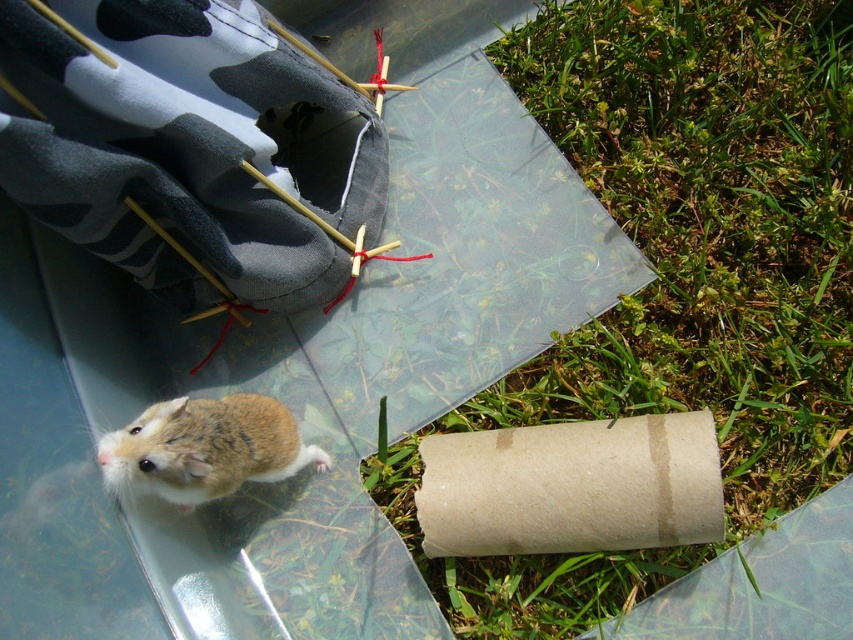
This screenshot has width=853, height=640. Describe the element at coordinates (572, 486) in the screenshot. I see `brown cardboard tube at lower right` at that location.

From the picture: Who is higher up, brown cardboard tube at lower right or brown fur hamster at lower left?

brown fur hamster at lower left is higher up.

Which is behind, point (469, 516) or point (142, 468)?

Point (469, 516)

Find the location of a particular element. brown cardboard tube at lower right is located at coordinates (572, 486).

Who is taller, green grass at lower right or brown fur hamster at lower left?

green grass at lower right is taller.

Is green grass at lower right below brown fur hamster at lower left?

No.

This screenshot has height=640, width=853. Find the location of `green grass at lower right`. green grass at lower right is located at coordinates (677, 278).

Is the position of green grass at lower right more distant than that of brown cardboard tube at lower right?

That is True.

Which is more to the right, green grass at lower right or brown cardboard tube at lower right?

From the viewer's perspective, green grass at lower right appears more on the right side.

Is point (564, 26) closer to viewer compared to point (477, 509)?

That is False.

The width and height of the screenshot is (853, 640). What are the coordinates of `green grass at lower right` in the screenshot? It's located at click(x=677, y=278).